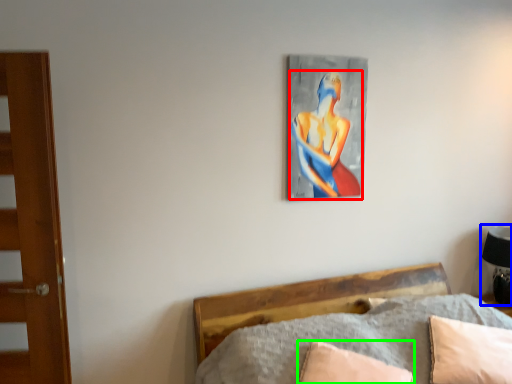
Question: Based on their relative distances, which object is farther from person (highlighted by a red box)? Choose from table lamp (highlighted by a blue box) and pillow (highlighted by a green box).

Choices:
 (A) table lamp
 (B) pillow

Answer: (A)